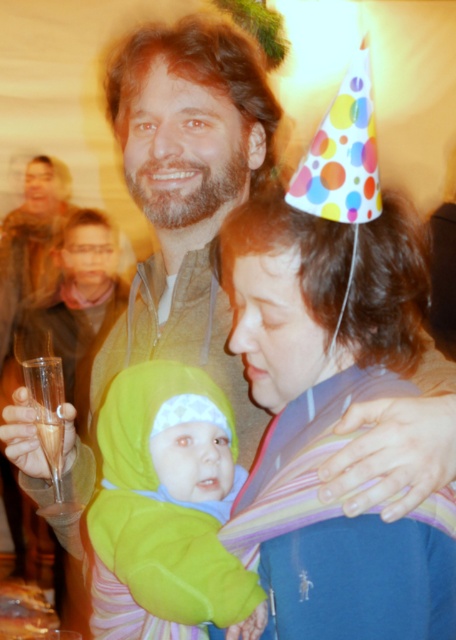
You are a photographer at the event and want to capture a closeup of the soft fleece baby at center without the matte purple scarf at center appearing in the shot. What adjustment can you make to your camera angle?

Lower your camera angle so that the soft fleece baby at center is framed below the matte purple scarf at center, which is currently above it.